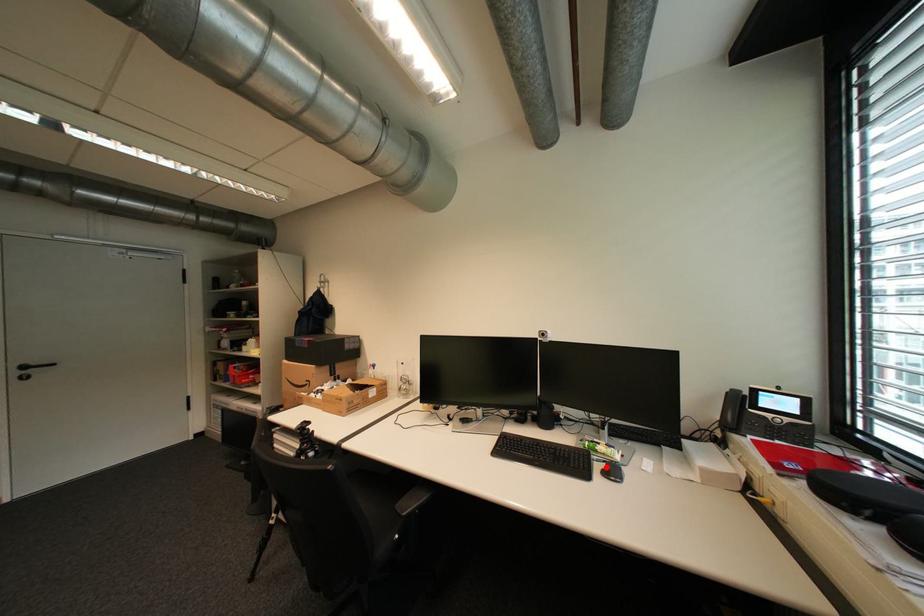
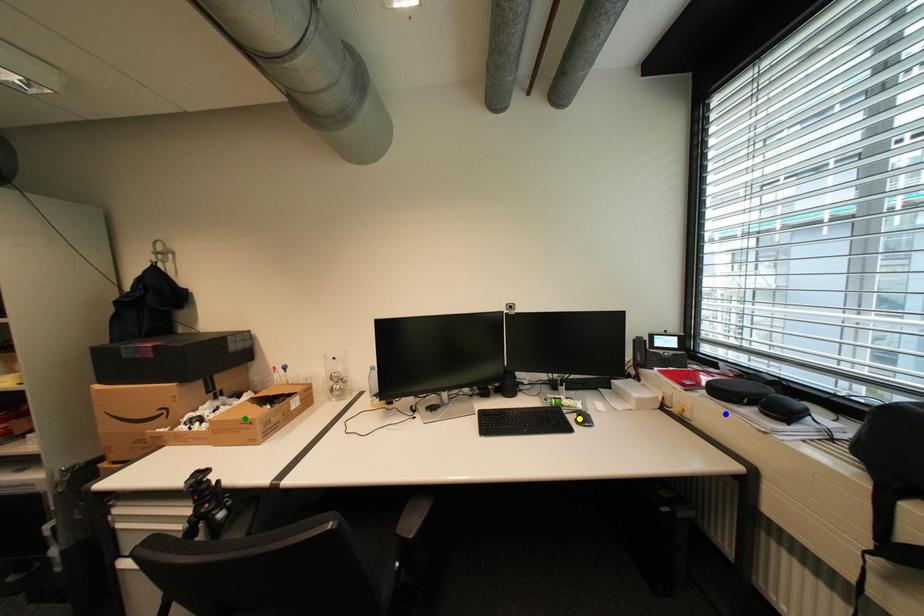
Question: I am providing you with two images of the same scene from different viewpoints. A red point is marked on the first image. You are given multiple points on the second image. Which point in image 2 represents the same 3d spot as the red point in image 1?

Choices:
 (A) blue point
 (B) green point
 (C) yellow point

Answer: (C)